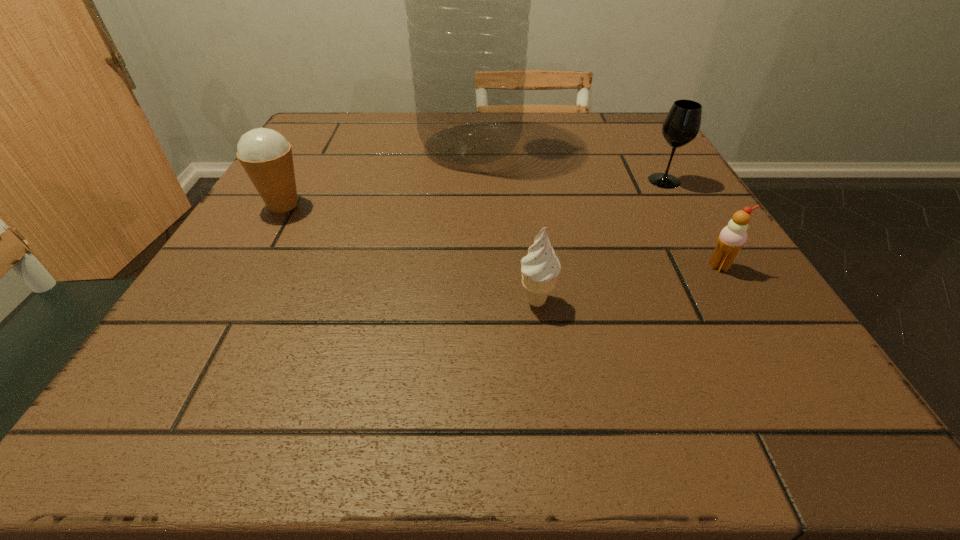
Find the location of `free location located on the left of the second farthest object`. free location located on the left of the second farthest object is located at coordinates (589, 181).

I want to click on vacant area located on the right of the leftmost icecream, so click(412, 205).

The width and height of the screenshot is (960, 540). What are the coordinates of `vacant space located 0.150m on the front-facing side of the nearest icecream` in the screenshot? It's located at (551, 410).

Locate an element on the screen. This screenshot has width=960, height=540. free space located 0.230m at the front with a straw on the shortest icecream is located at coordinates (802, 404).

Locate an element on the screen. The image size is (960, 540). object that is positioned at the far edge is located at coordinates (467, 0).

Locate an element on the screen. This screenshot has width=960, height=540. object that is at the left edge is located at coordinates (266, 156).

Identify the location of wineglass present at the right edge. (681, 125).

Locate an element on the screen. The height and width of the screenshot is (540, 960). icecream that is at the right edge is located at coordinates (732, 238).

This screenshot has width=960, height=540. I want to click on vacant space at the far edge of the desktop, so click(386, 134).

In the image, there is a desktop. Identify the location of vacant space at the near edge. (684, 433).